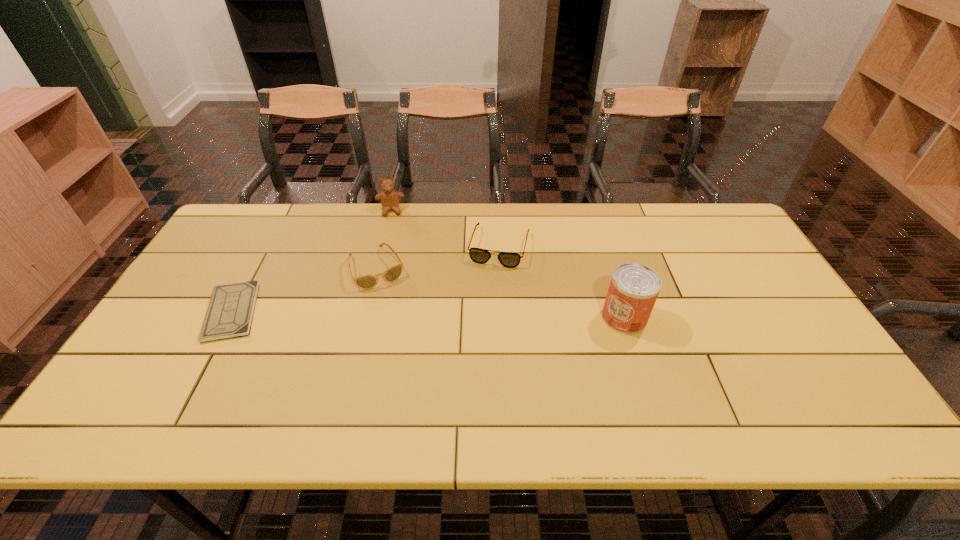
Where is `the shortest object`? The height and width of the screenshot is (540, 960). the shortest object is located at coordinates (230, 311).

You are a GUI agent. You are given a task and a screenshot of the screen. Output one action in this format:
    pyautogui.click(x=<x>, y=<y>)
    Task: Click on the checkbook
    
    Given the screenshot: What is the action you would take?
    pyautogui.click(x=230, y=311)

Find the location of a particular element. can is located at coordinates (633, 290).

The height and width of the screenshot is (540, 960). In order to click on the tallest object in this screenshot , I will do `click(633, 290)`.

Where is `sunglasses`? This screenshot has width=960, height=540. sunglasses is located at coordinates (x=393, y=273).

This screenshot has height=540, width=960. Identify the location of spectacles. (507, 259).

Locate an element on the screen. The image size is (960, 540). the second tallest object is located at coordinates (389, 197).

Image resolution: width=960 pixels, height=540 pixels. What are the coordinates of `teddy bear` in the screenshot? It's located at (389, 197).

Locate an element on the screen. The height and width of the screenshot is (540, 960). free region located on the back of the checkbook is located at coordinates (270, 242).

I want to click on blank space located 0.060m on the left of the rightmost object, so click(x=580, y=317).